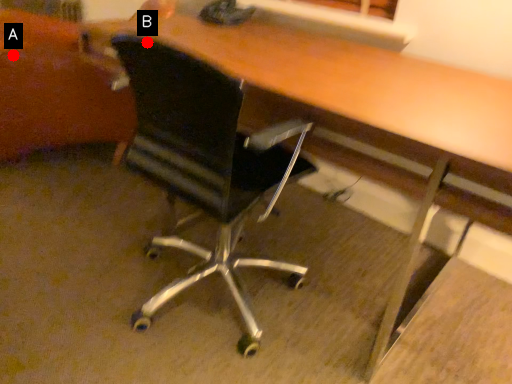
Question: Two points are circled on the image, labeled by A and B beside each circle. Which point appears farthest from the camera in this image?

Choices:
 (A) A is further
 (B) B is further

Answer: (A)